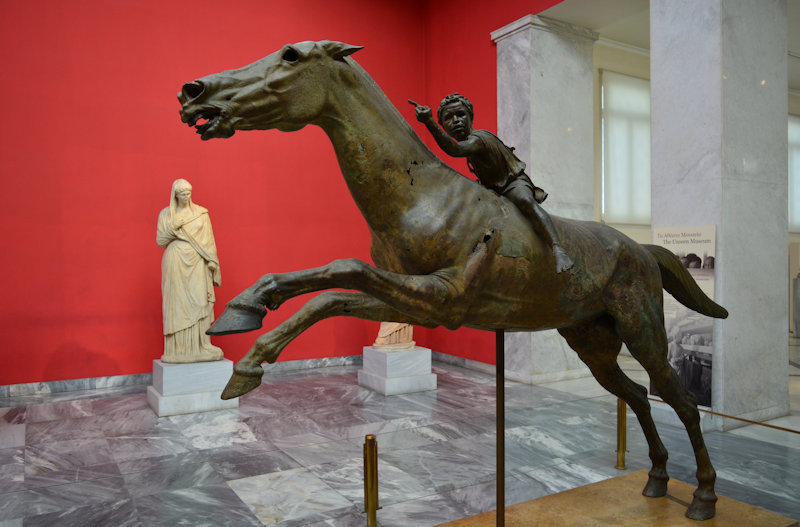
Locate an element on the screen. This screenshot has height=527, width=800. wall is located at coordinates (126, 115).